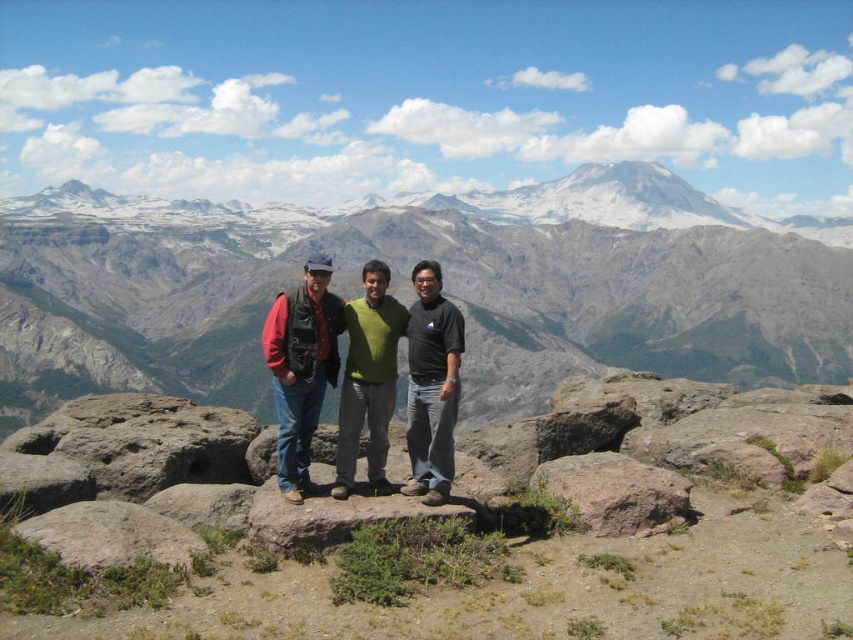
Question: Which of the following is the closest to the observer?

Choices:
 (A) (308, 435)
 (B) (370, 369)

Answer: (A)

Question: Does matte black jacket at center appear on the right side of brown rough rock at lower right?

Choices:
 (A) no
 (B) yes

Answer: (A)

Question: Is matte black jacket at center further to camera compared to gray rough rock at lower left?

Choices:
 (A) no
 (B) yes

Answer: (B)

Question: Is black matte shirt at center bigger than brown rough rock at lower right?

Choices:
 (A) no
 (B) yes

Answer: (B)

Question: Which point is closer to the camera?

Choices:
 (A) rusty rock at center
 (B) brown rough rock at lower right
 (C) brown rock at center

Answer: (C)

Question: Which of the following is the farthest from the observer?

Choices:
 (A) (271, 509)
 (B) (434, 349)
 (C) (334, 314)

Answer: (C)